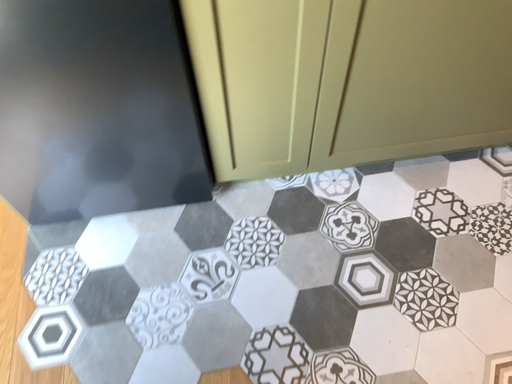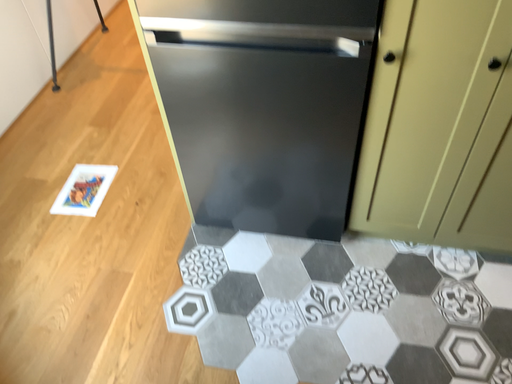
Question: How did the camera likely rotate when shooting the video?

Choices:
 (A) rotated left
 (B) rotated right

Answer: (A)